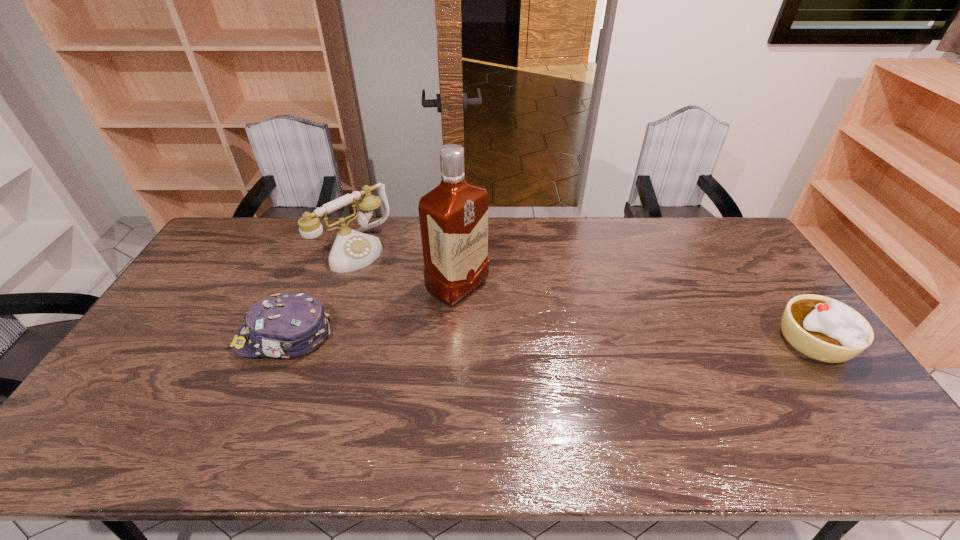
At what (x,y) coordinates should I click in order to perform the action: click on vacant space at the left edge of the desktop. Please return your answer as a coordinate pair (x, y). Looking at the image, I should click on (207, 326).

Locate an element on the screen. free location at the far right corner is located at coordinates (742, 254).

What are the coordinates of `free space that is in between the whipped cream and the third object from left to right` in the screenshot? It's located at tap(636, 314).

At what (x,y) coordinates should I click in order to perform the action: click on free space between the liquor and the shortest object. Please return your answer as a coordinate pair (x, y). This screenshot has width=960, height=540. Looking at the image, I should click on (371, 313).

Locate an element on the screen. The height and width of the screenshot is (540, 960). vacant space in between the headwear and the third shortest object is located at coordinates (319, 293).

Where is `blank region between the telephone and the third object from left to right`? Image resolution: width=960 pixels, height=540 pixels. blank region between the telephone and the third object from left to right is located at coordinates (406, 268).

The height and width of the screenshot is (540, 960). I want to click on vacant space in between the telephone and the shortest object, so click(x=319, y=293).

I want to click on vacant point located between the shortest object and the second shortest object, so pyautogui.click(x=549, y=339).

Find the location of a particular element. Image resolution: width=960 pixels, height=540 pixels. vacant space in between the third object from left to right and the second tallest object is located at coordinates pos(406,268).

Where is `vacant area that lies between the shortest object and the tallest object`? Image resolution: width=960 pixels, height=540 pixels. vacant area that lies between the shortest object and the tallest object is located at coordinates (371, 313).